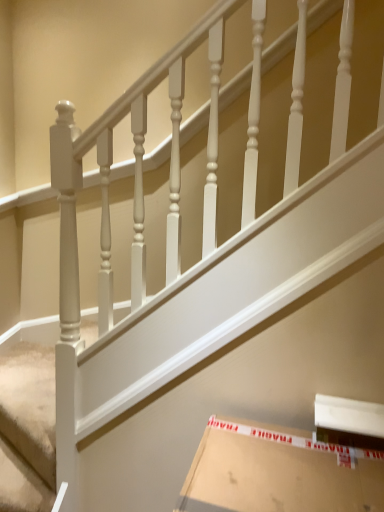
This screenshot has width=384, height=512. I want to click on free location above white cardboard box at lower right (from a real-world perspective), so click(280, 454).